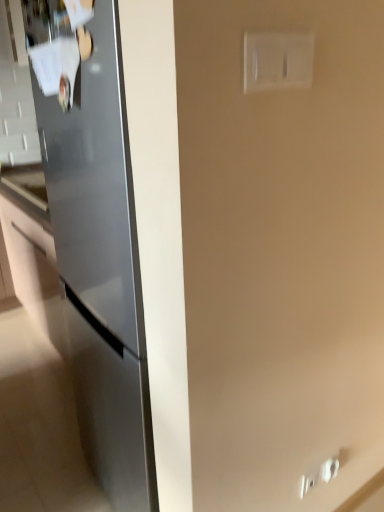
Question: Does sleek metallic refrigerator at left have a greater width compared to white plastic switch at upper right?

Choices:
 (A) no
 (B) yes

Answer: (B)

Question: Is sleek metallic refrigerator at left surrounding white plastic switch at upper right?

Choices:
 (A) no
 (B) yes

Answer: (A)

Question: Is sleek metallic refrigerator at left located outside white plastic switch at upper right?

Choices:
 (A) yes
 (B) no

Answer: (A)

Question: Can you confirm if sleek metallic refrigerator at left is positioned to the left of white plastic switch at upper right?

Choices:
 (A) yes
 (B) no

Answer: (A)

Question: Is sleek metallic refrigerator at left positioned behind white plastic switch at upper right?

Choices:
 (A) yes
 (B) no

Answer: (A)

Question: From the image's perspective, is sleek metallic refrigerator at left under white plastic switch at upper right?

Choices:
 (A) no
 (B) yes

Answer: (B)

Question: Considering the relative sizes of white plastic switch at upper right and sleek metallic refrigerator at left in the image provided, is white plastic switch at upper right taller than sleek metallic refrigerator at left?

Choices:
 (A) yes
 (B) no

Answer: (B)

Question: Is white plastic switch at upper right not close to sleek metallic refrigerator at left?

Choices:
 (A) no
 (B) yes

Answer: (A)

Question: Would you say sleek metallic refrigerator at left is part of white plastic switch at upper right's contents?

Choices:
 (A) no
 (B) yes

Answer: (A)

Question: Is white plastic switch at upper right further to the viewer compared to sleek metallic refrigerator at left?

Choices:
 (A) no
 (B) yes

Answer: (A)

Question: From a real-world perspective, does white plastic switch at upper right sit lower than sleek metallic refrigerator at left?

Choices:
 (A) no
 (B) yes

Answer: (A)

Question: Can you confirm if white plastic switch at upper right is positioned to the right of sleek metallic refrigerator at left?

Choices:
 (A) no
 (B) yes

Answer: (B)

Question: In terms of size, does white plastic switch at upper right appear bigger or smaller than sleek metallic refrigerator at left?

Choices:
 (A) big
 (B) small

Answer: (B)